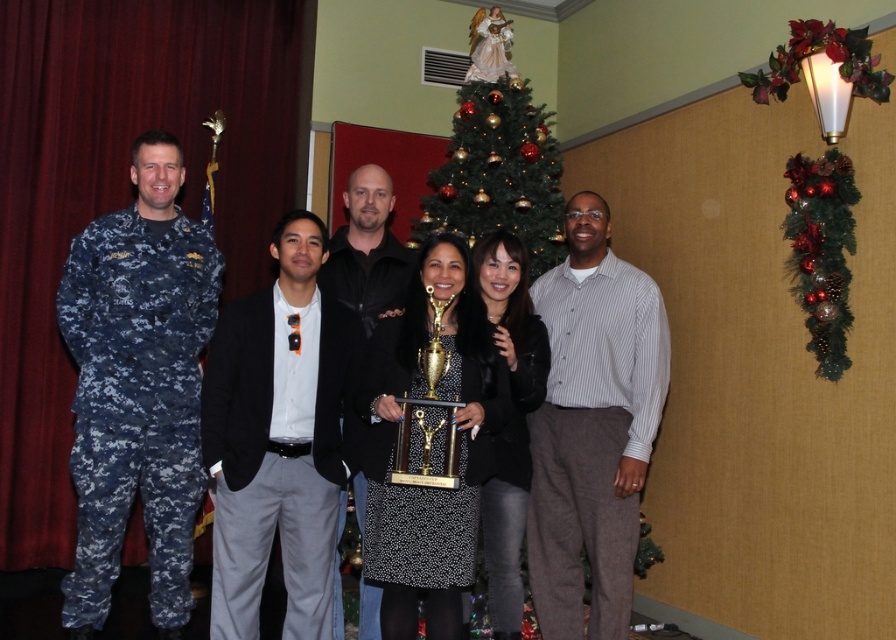
You are a photographer adjusting the camera settings to ensure all subjects are in focus. The black fabric dress at center and the black leather jacket at center are both in the frame. Which of these two items is positioned closer to the camera?

The black fabric dress at center is much taller than the black leather jacket at center, so it is positioned closer to the camera.